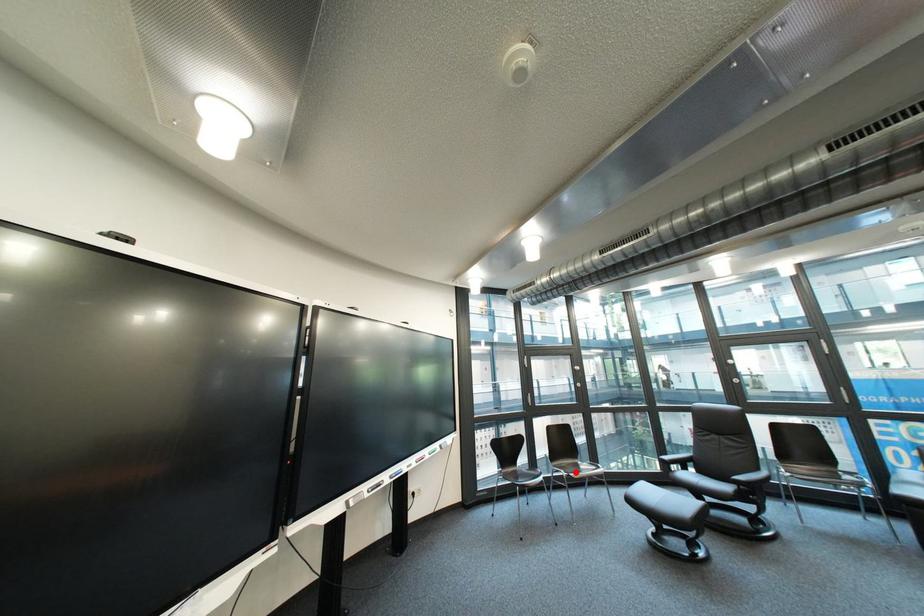
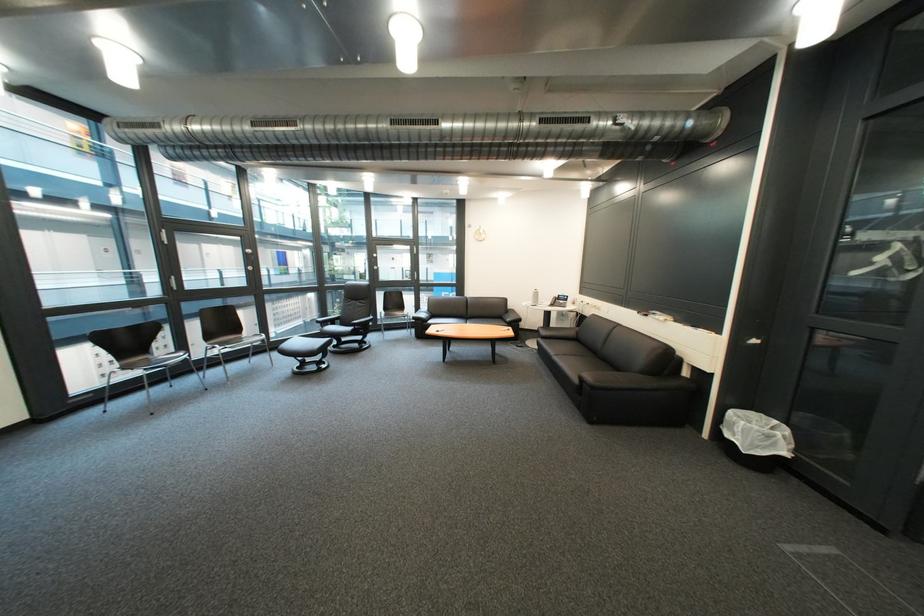
Question: I am providing you with two images of the same scene from different viewpoints. Image1 has a red point marked. In image2, the corresponding 3D location appears at what relative position? Reply with the corresponding letter.

Choices:
 (A) Closer
 (B) Farther

Answer: (A)